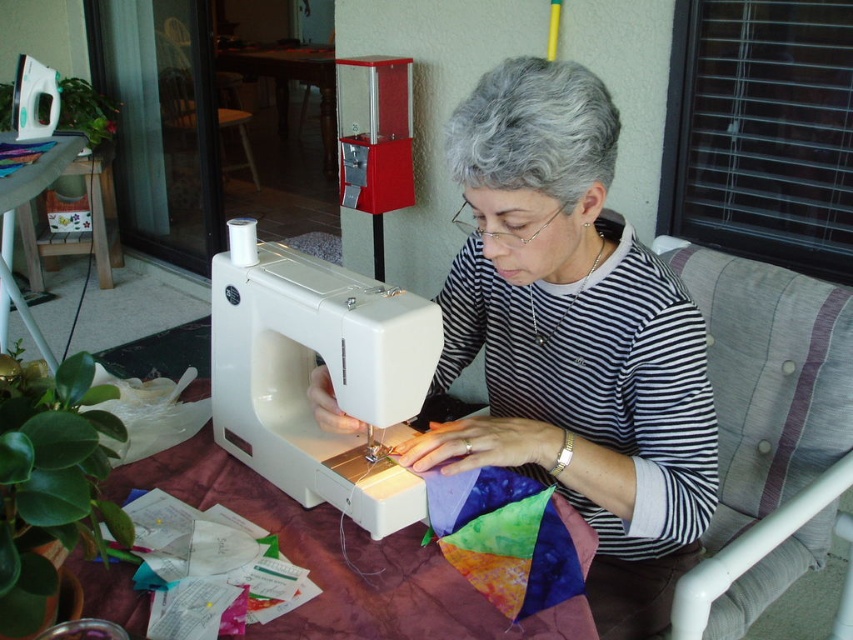
You are standing in the sunroom where the sewing is taking place. You need to place a new fabric roll on the table so that it is directly to the left of the striped fabric shirt at center. Where should you place the new fabric roll?

The striped fabric shirt at center is located at coordinates point (573,339). To place the new fabric roll directly to the left of it, position the roll at a point with the same y coordinate but a lower x coordinate than 0.530.

You are a tailor who needs to place a new fabric roll next to the striped fabric shirt at center and the white plastic sewing machine at center on the table. Considering the limited space, can you fit the fabric roll between them if it requires at least 7 inches of space?

The striped fabric shirt at center is only 6.99 inches from the white plastic sewing machine at center, which is less than the required 7 inches. Therefore, there isn not enough space to fit the fabric roll between them.

You are a tailor working on a sewing project. You need to place a striped fabric shirt at center onto the sewing machine located at point (573,339). Is the striped fabric shirt at center already positioned correctly on the sewing machine?

The striped fabric shirt at center is located at point (573,339), which is exactly where the sewing machine is placed. Therefore, the striped fabric shirt at center is already positioned correctly on the sewing machine.